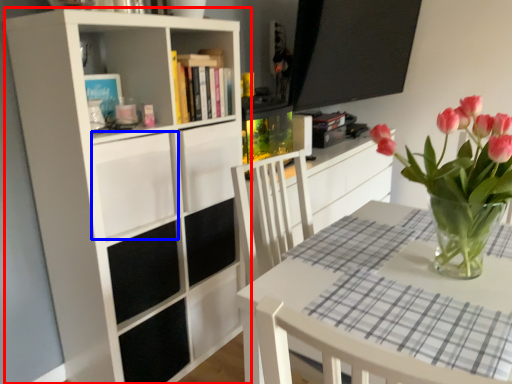
Question: Among these objects, which one is nearest to the camera, bookcase (highlighted by a red box) or drawer (highlighted by a blue box)?

Choices:
 (A) bookcase
 (B) drawer

Answer: (A)